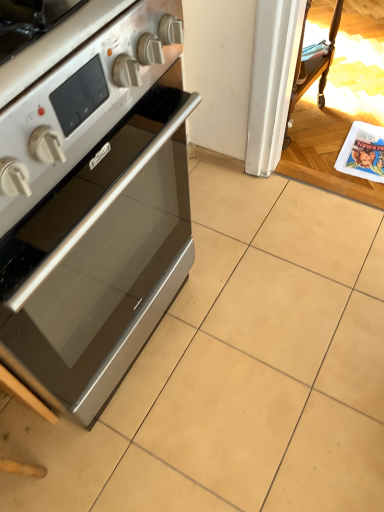
The image size is (384, 512). Describe the element at coordinates (95, 207) in the screenshot. I see `satin silver oven at left` at that location.

Measure the distance between satin silver oven at left and camera.

satin silver oven at left is 16.22 inches away from camera.

At what (x,y) coordinates should I click in order to perform the action: click on satin silver oven at left. Please return your answer as a coordinate pair (x, y). The height and width of the screenshot is (512, 384). Looking at the image, I should click on (95, 207).

The image size is (384, 512). Describe the element at coordinates (363, 152) in the screenshot. I see `white glossy magazine at right` at that location.

You are a GUI agent. You are given a task and a screenshot of the screen. Output one action in this format:
    pyautogui.click(x=<x>, y=<y>)
    Task: Click on the white glossy magazine at right
    
    Given the screenshot: What is the action you would take?
    pyautogui.click(x=363, y=152)

Locate an element on the screen. The height and width of the screenshot is (512, 384). satin silver oven at left is located at coordinates (x=95, y=207).

Based on their positions, is white glossy magazine at right located to the left or right of satin silver oven at left?

white glossy magazine at right is positioned on satin silver oven at left's right side.

Does white glossy magazine at right lie behind satin silver oven at left?

Yes, the depth of white glossy magazine at right is greater than that of satin silver oven at left.

Is point (377, 147) positioned after point (143, 178)?

Yes, point (377, 147) is farther from viewer.

From the image's perspective, which one is positioned higher, white glossy magazine at right or satin silver oven at left?

white glossy magazine at right.

Based on the photo, from a real-world perspective, relative to satin silver oven at left, is white glossy magazine at right vertically above or below?

white glossy magazine at right is below satin silver oven at left.

Based on the photo, is white glossy magazine at right wider than satin silver oven at left?

In fact, white glossy magazine at right might be narrower than satin silver oven at left.

Considering the sizes of objects white glossy magazine at right and satin silver oven at left in the image provided, who is taller, white glossy magazine at right or satin silver oven at left?

With more height is satin silver oven at left.

In the scene shown: Considering the sizes of objects white glossy magazine at right and satin silver oven at left in the image provided, who is smaller, white glossy magazine at right or satin silver oven at left?

With smaller size is white glossy magazine at right.

Can satin silver oven at left be found inside white glossy magazine at right?

That's incorrect, satin silver oven at left is not inside white glossy magazine at right.

From the picture: Is white glossy magazine at right with satin silver oven at left?

No.

Consider the image. Is white glossy magazine at right looking in the opposite direction of satin silver oven at left?

No, satin silver oven at left is not at the back of white glossy magazine at right.

Locate an element on the screen. magazine located underneath the satin silver oven at left (from a real-world perspective) is located at coordinates (363, 152).

Which is more to the left, satin silver oven at left or white glossy magazine at right?

From the viewer's perspective, satin silver oven at left appears more on the left side.

Which is in front, satin silver oven at left or white glossy magazine at right?

satin silver oven at left is closer to the camera.

Considering the positions of point (46, 200) and point (372, 130), is point (46, 200) closer or farther from the camera than point (372, 130)?

Point (46, 200) is positioned closer to the camera compared to point (372, 130).

From the image's perspective, is satin silver oven at left located above or below white glossy magazine at right?

From the image's perspective, satin silver oven at left appears below white glossy magazine at right.

From a real-world perspective, which is physically below, satin silver oven at left or white glossy magazine at right?

white glossy magazine at right.

Between satin silver oven at left and white glossy magazine at right, which one has smaller width?

white glossy magazine at right.

Who is shorter, satin silver oven at left or white glossy magazine at right?

white glossy magazine at right.

Which of these two, satin silver oven at left or white glossy magazine at right, is smaller?

white glossy magazine at right.

Is satin silver oven at left located outside white glossy magazine at right?

Yes, satin silver oven at left is outside of white glossy magazine at right.

Are satin silver oven at left and white glossy magazine at right far apart?

Absolutely, satin silver oven at left is distant from white glossy magazine at right.

Is satin silver oven at left turned away from white glossy magazine at right?

satin silver oven at left does not have its back to white glossy magazine at right.

How different are the orientations of satin silver oven at left and white glossy magazine at right in degrees?

They differ by 85.6 degrees in their facing directions.

The height and width of the screenshot is (512, 384). I want to click on magazine located above the satin silver oven at left (from the image's perspective), so click(363, 152).

Where is `magazine that appears behind the satin silver oven at left`? The width and height of the screenshot is (384, 512). magazine that appears behind the satin silver oven at left is located at coordinates (363, 152).

Find the location of a particular element. The image size is (384, 512). magazine located on the right of satin silver oven at left is located at coordinates (363, 152).